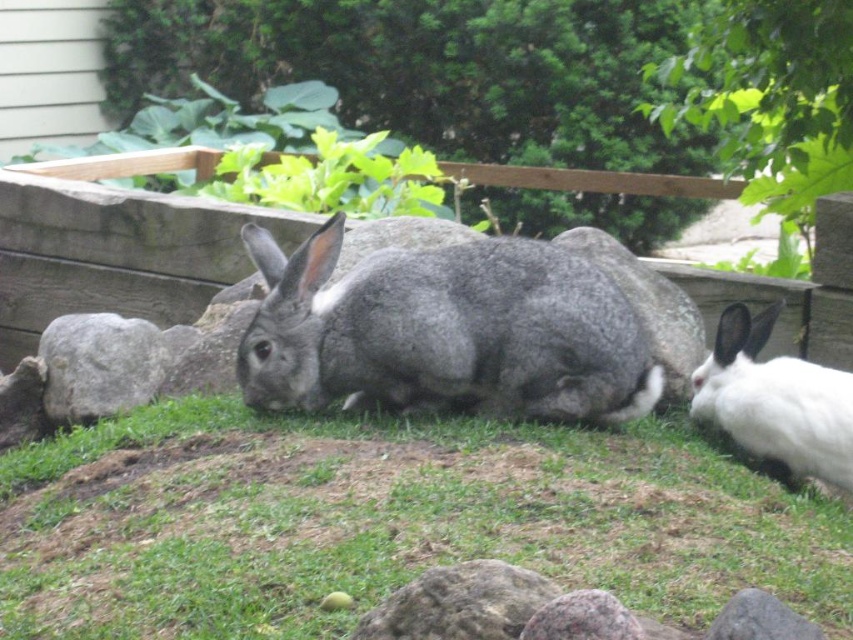
Question: Which object is positioned farthest from the green grass at lower center?

Choices:
 (A) white fluffy rabbit at right
 (B) gray rough stone at lower left
 (C) gray furry rabbit at center

Answer: (B)

Question: Can you confirm if green grass at lower center is positioned below gray furry rabbit at center?

Choices:
 (A) yes
 (B) no

Answer: (A)

Question: Estimate the real-world distances between objects in this image. Which object is closer to the green grass at lower center?

Choices:
 (A) white fluffy rabbit at right
 (B) gray rough stone at lower left
 (C) gray furry rabbit at center

Answer: (C)

Question: Does green grass at lower center come behind gray furry rabbit at center?

Choices:
 (A) yes
 (B) no

Answer: (B)

Question: Among these objects, which one is nearest to the camera?

Choices:
 (A) gray rough stone at lower left
 (B) white fluffy rabbit at right
 (C) green grass at lower center
 (D) gray furry rabbit at center

Answer: (C)

Question: Can you confirm if white fluffy rabbit at right is positioned below gray rough stone at lower left?

Choices:
 (A) no
 (B) yes

Answer: (B)